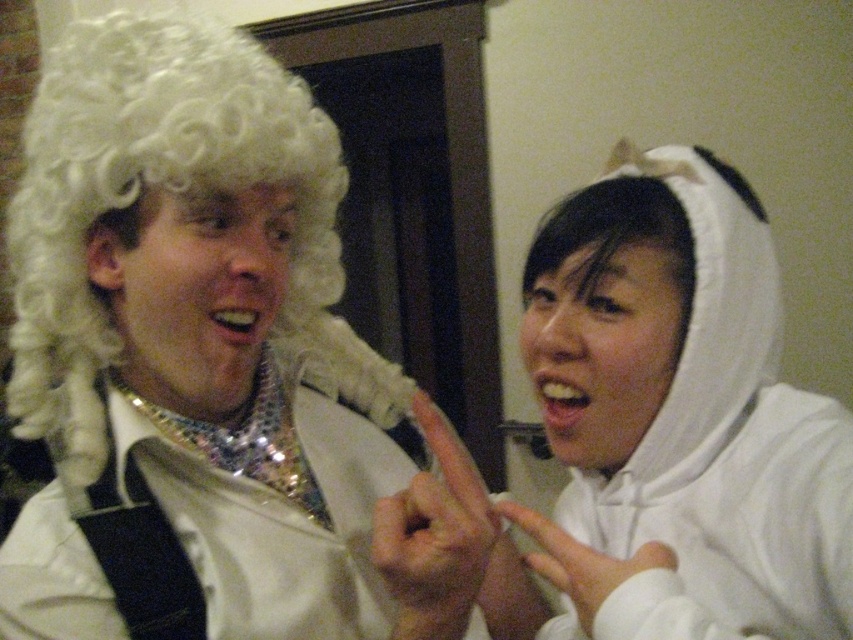
Does white plush hoodie at upper right have a larger size compared to shiny sequined robe at left?

Correct, white plush hoodie at upper right is larger in size than shiny sequined robe at left.

Between white plush hoodie at upper right and shiny sequined robe at left, which one is positioned higher?

white plush hoodie at upper right is higher up.

Does point (601, 616) come behind point (165, 536)?

No.

The image size is (853, 640). Find the location of `white plush hoodie at upper right`. white plush hoodie at upper right is located at coordinates (677, 417).

Does white plush hoodie at upper right have a smaller size compared to white curly wig at left?

Incorrect, white plush hoodie at upper right is not smaller in size than white curly wig at left.

Is white plush hoodie at upper right wider than white curly wig at left?

Incorrect, white plush hoodie at upper right's width does not surpass white curly wig at left's.

Is point (585, 188) farther from viewer compared to point (96, 156)?

Yes, point (585, 188) is farther from viewer.

Find the location of a particular element. The width and height of the screenshot is (853, 640). white plush hoodie at upper right is located at coordinates (677, 417).

Is white curly wig at left above shiny sequined robe at left?

Correct, white curly wig at left is located above shiny sequined robe at left.

What do you see at coordinates (173, 192) in the screenshot?
I see `white curly wig at left` at bounding box center [173, 192].

You are a GUI agent. You are given a task and a screenshot of the screen. Output one action in this format:
    pyautogui.click(x=<x>, y=<y>)
    Task: Click on the white curly wig at left
    This screenshot has width=853, height=640.
    Given the screenshot: What is the action you would take?
    pyautogui.click(x=173, y=192)